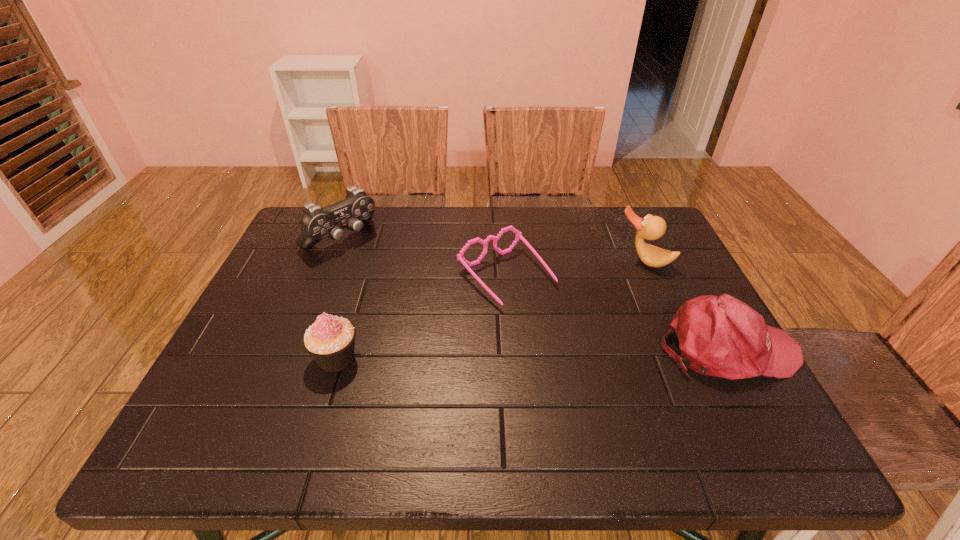
Locate an element on the screen. Image resolution: width=960 pixels, height=540 pixels. free space on the desktop that is between the cupcake and the baseball cap and is positioned on the beak of the duck is located at coordinates (589, 351).

What are the coordinates of `free space on the desktop that is between the cupcake and the baseball cap and is positioned on the surface of the control with buttons` in the screenshot? It's located at (480, 354).

Where is `vacant space on the desktop that is between the cupcake and the baseball cap and is positioned on the arms of the third object from left to right`? vacant space on the desktop that is between the cupcake and the baseball cap and is positioned on the arms of the third object from left to right is located at coordinates (579, 352).